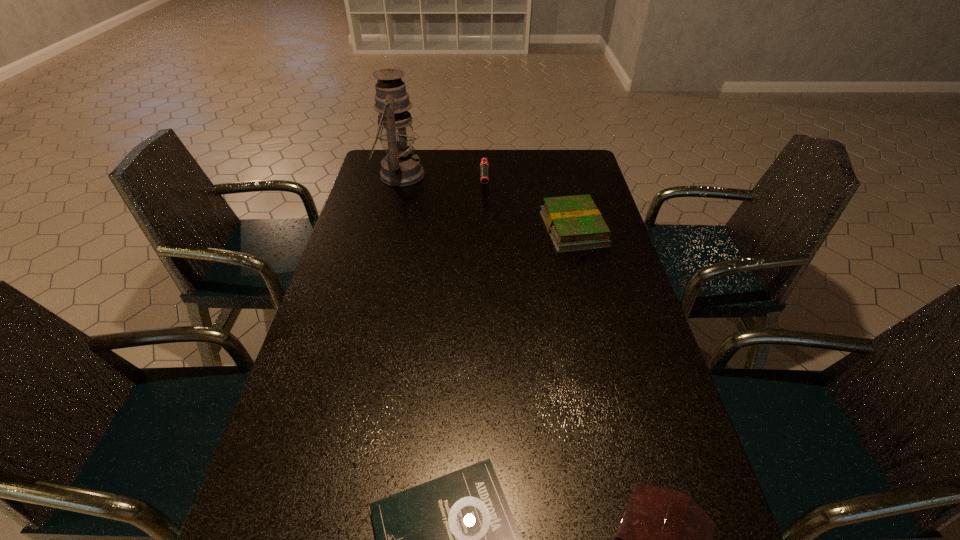
Select which object is the fourth closest to the third farthest object. Please provide its 2D coordinates. Your answer should be formatted as a tuple, i.e. [(x, y)], where the tuple contains the x and y coordinates of a point satisfying the conditions above.

[(667, 539)]

Where is `object that stands as the third closest to the leftmost book`? The width and height of the screenshot is (960, 540). object that stands as the third closest to the leftmost book is located at coordinates (484, 165).

Point out which book is positioned as the third nearest to the oil lamp. Please provide its 2D coordinates. Your answer should be formatted as a tuple, i.e. [(x, y)], where the tuple contains the x and y coordinates of a point satisfying the conditions above.

[(667, 539)]

Select which book is the third closest to the second tallest object. Please provide its 2D coordinates. Your answer should be formatted as a tuple, i.e. [(x, y)], where the tuple contains the x and y coordinates of a point satisfying the conditions above.

[(667, 539)]